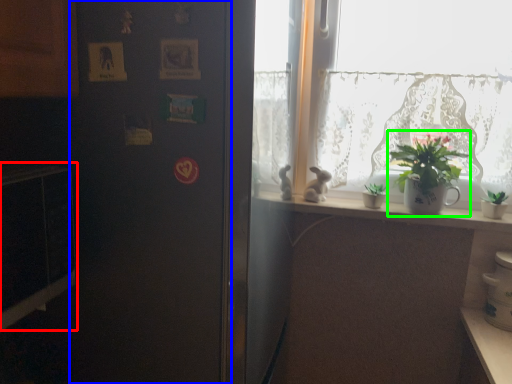
Question: Based on their relative distances, which object is nearer to microwave (highlighted by a red box)? Choose from screen door (highlighted by a blue box) and houseplant (highlighted by a green box).

Choices:
 (A) screen door
 (B) houseplant

Answer: (A)